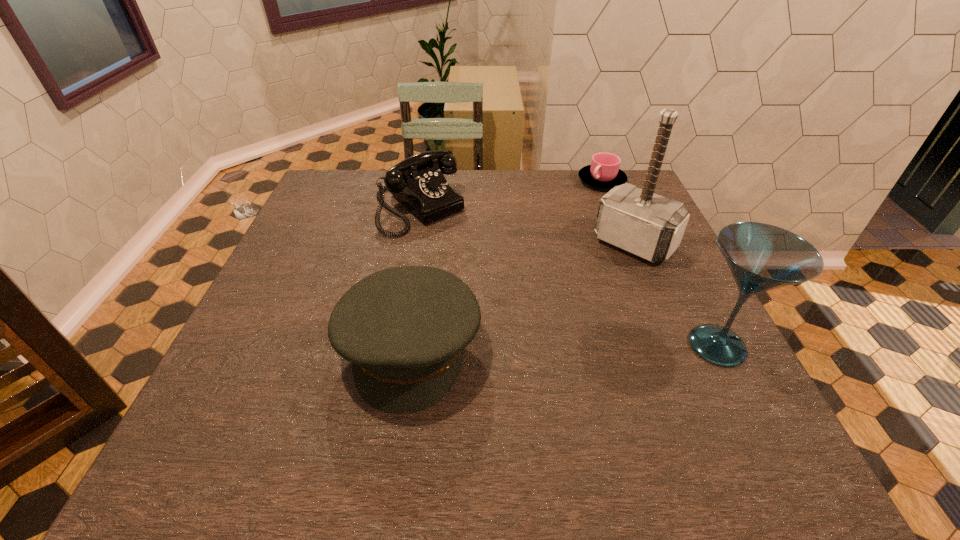
Locate an element on the screen. Image resolution: width=960 pixels, height=540 pixels. hammer located in the right edge section of the desktop is located at coordinates (650, 226).

The height and width of the screenshot is (540, 960). Find the location of `cup that is at the right edge`. cup that is at the right edge is located at coordinates (604, 172).

I want to click on object at the far right corner, so click(604, 172).

Where is `object that is at the near right corner`? This screenshot has width=960, height=540. object that is at the near right corner is located at coordinates (761, 257).

Where is `vacant space at the far edge of the desktop`? The height and width of the screenshot is (540, 960). vacant space at the far edge of the desktop is located at coordinates (566, 198).

Where is `vacant region at the near edge`? vacant region at the near edge is located at coordinates (504, 399).

Image resolution: width=960 pixels, height=540 pixels. I want to click on vacant position at the left edge of the desktop, so click(x=342, y=215).

The height and width of the screenshot is (540, 960). What are the coordinates of `vacant area at the right edge of the desktop` in the screenshot? It's located at (631, 260).

In the image, there is a desktop. At what (x,y) coordinates should I click in order to perform the action: click on blank space at the far left corner. Please return your answer as a coordinate pair (x, y). Looking at the image, I should click on (352, 190).

The image size is (960, 540). I want to click on free space at the near left corner of the desktop, so click(x=220, y=415).